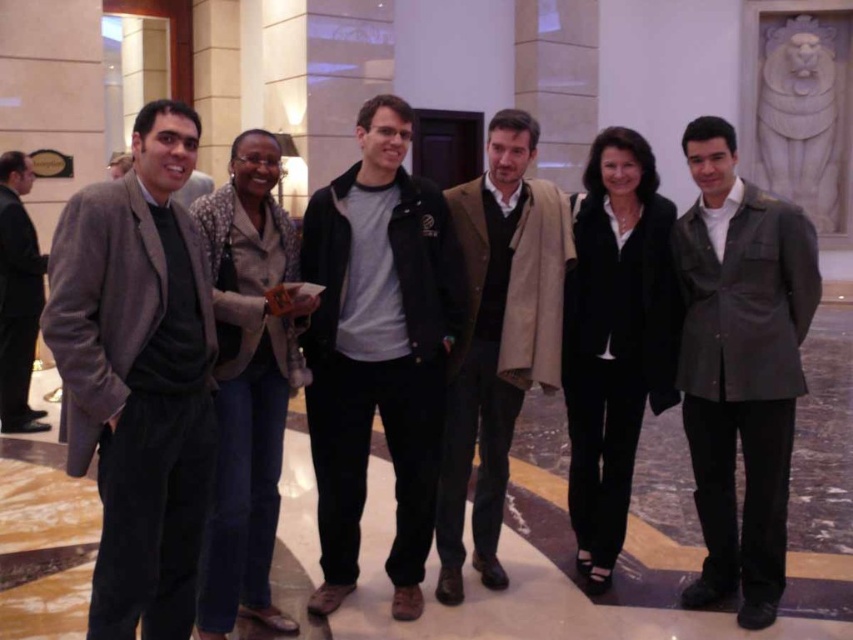
You are standing in the hotel lobby and want to move from point A to point B. Point A is at coordinate point (755,465) and point B is at coordinate point (13,257). Which point is closer to you when you first arrive at the lobby?

Point A at coordinate point (755,465) is closer to the viewer than point B at coordinate point (13,257), so you would first encounter point A when arriving at the lobby.

You are a photographer adjusting your camera settings to focus on the dark gray leather jacket at right and the dark gray suit at left. Which object should you focus on first to ensure both are in sharp focus?

You should focus on the dark gray suit at left first because it is further away from the viewer compared to the dark gray leather jacket at right, ensuring both will be in sharp focus when starting from the farther object.